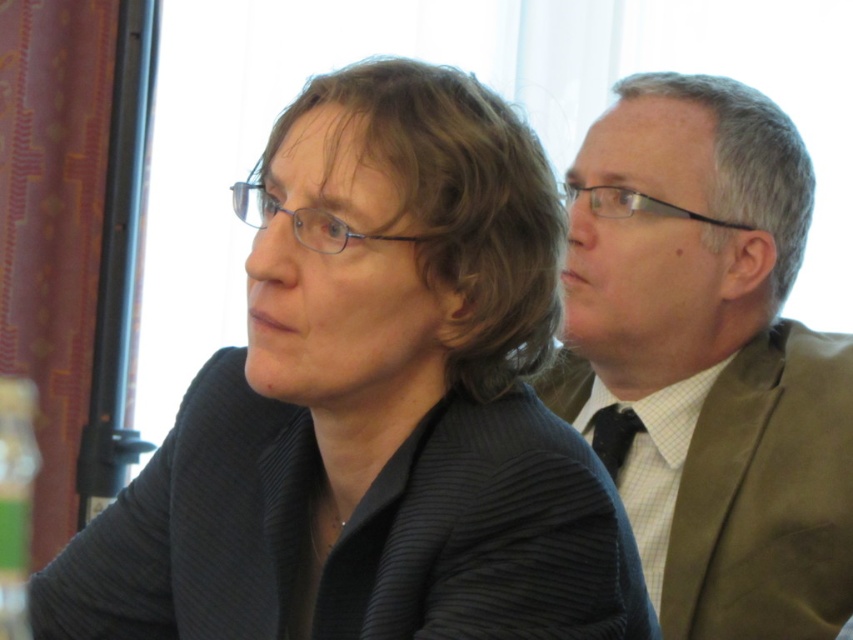
Is black textured blazer at center smaller than matte olive-green suit at right?

No, black textured blazer at center is not smaller than matte olive-green suit at right.

Identify the location of black textured blazer at center. Image resolution: width=853 pixels, height=640 pixels. (373, 406).

From the picture: Who is more forward, (84, 588) or (793, 144)?

Point (84, 588)

Image resolution: width=853 pixels, height=640 pixels. Identify the location of black textured blazer at center. (373, 406).